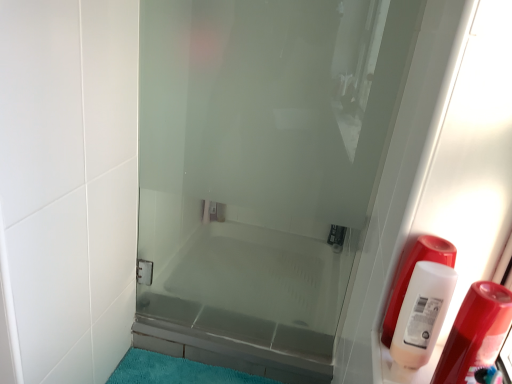
Question: Does white plastic bottle at right have a larger size compared to teal plush bath mat at lower center?

Choices:
 (A) no
 (B) yes

Answer: (A)

Question: Is white plastic bottle at right placed right next to teal plush bath mat at lower center?

Choices:
 (A) no
 (B) yes

Answer: (A)

Question: Is white plastic bottle at right not inside teal plush bath mat at lower center?

Choices:
 (A) no
 (B) yes

Answer: (B)

Question: Could teal plush bath mat at lower center be considered to be inside white plastic bottle at right?

Choices:
 (A) no
 (B) yes

Answer: (A)

Question: Considering the relative sizes of white plastic bottle at right and teal plush bath mat at lower center in the image provided, is white plastic bottle at right shorter than teal plush bath mat at lower center?

Choices:
 (A) no
 (B) yes

Answer: (A)

Question: From a real-world perspective, is teal plush bath mat at lower center physically located above or below white plastic bottle at right?

Choices:
 (A) above
 (B) below

Answer: (B)

Question: Is point (148, 354) positioned closer to the camera than point (471, 377)?

Choices:
 (A) farther
 (B) closer

Answer: (A)

Question: From their relative heights in the image, would you say teal plush bath mat at lower center is taller or shorter than white plastic bottle at right?

Choices:
 (A) tall
 (B) short

Answer: (B)

Question: Which is correct: teal plush bath mat at lower center is inside white plastic bottle at right, or outside of it?

Choices:
 (A) inside
 (B) outside

Answer: (B)

Question: Is white plastic bottle at right situated inside white plastic bottle at right or outside?

Choices:
 (A) outside
 (B) inside

Answer: (A)

Question: In the image, is white plastic bottle at right positioned in front of or behind white plastic bottle at right?

Choices:
 (A) behind
 (B) front

Answer: (A)

Question: In the image, is white plastic bottle at right on the left side or the right side of white plastic bottle at right?

Choices:
 (A) right
 (B) left

Answer: (B)

Question: From a real-world perspective, relative to white plastic bottle at right, is white plastic bottle at right vertically above or below?

Choices:
 (A) below
 (B) above

Answer: (A)

Question: Considering the positions of teal plush bath mat at lower center and transparent glass door at center in the image, is teal plush bath mat at lower center wider or thinner than transparent glass door at center?

Choices:
 (A) thin
 (B) wide

Answer: (B)

Question: From a real-world perspective, relative to transparent glass door at center, is teal plush bath mat at lower center vertically above or below?

Choices:
 (A) below
 (B) above

Answer: (A)